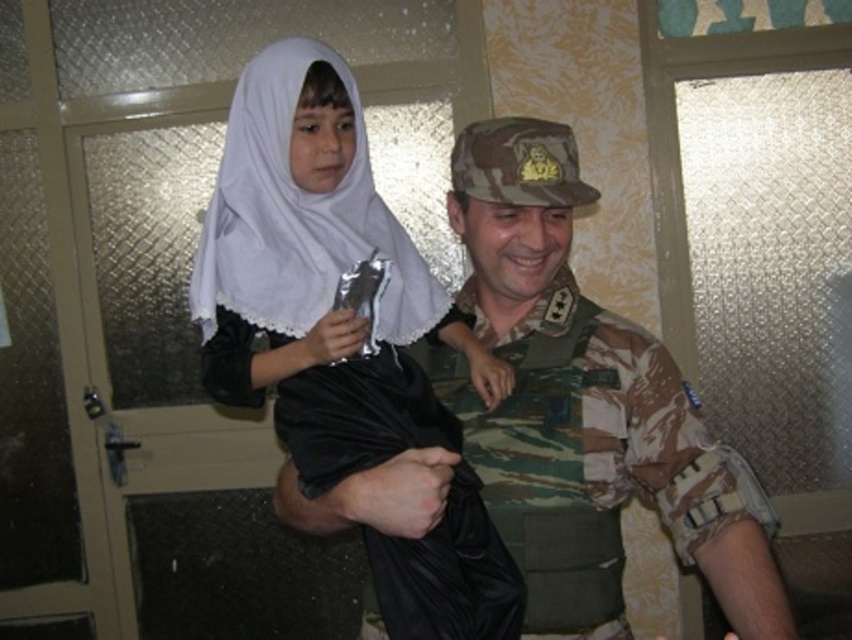
You are planning to take a photo of the camouflage uniform at center and the white sheer veil at upper left. Which object should you focus on first if you want to capture both in the same frame without moving the camera?

The camouflage uniform at center is larger in size compared to the white sheer veil at upper left, so you should focus on the camouflage uniform at center first to ensure it fits properly in the frame before adjusting for the smaller object.

You are a photographer trying to capture a clear shot of the white satin hijab at center and the white sheer veil at upper left. Which of these two items is closer to the camera?

The white satin hijab at center is positioned under the white sheer veil at upper left, meaning the veil is closer to the camera than the hijab.